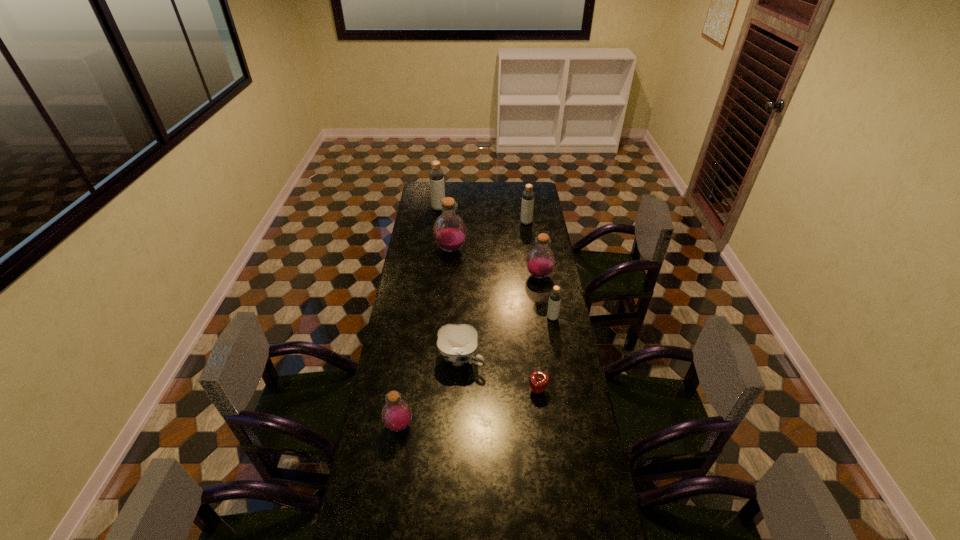
Find the location of `purple bottle that is the second closest to the second smallest purple bottle`. purple bottle that is the second closest to the second smallest purple bottle is located at coordinates (396, 414).

This screenshot has width=960, height=540. What are the coordinates of `vacant area in the image that satisfies the following two spatial constraints: 1. on the back side of the sixth farthest object; 2. on the right side of the second biggest gray bottle` in the screenshot? It's located at (468, 222).

The width and height of the screenshot is (960, 540). In order to click on blank area in the image that satisfies the following two spatial constraints: 1. on the back side of the second farthest purple bottle; 2. on the left side of the blue chinaware in this screenshot , I will do `click(465, 276)`.

Where is `vacant area that satisfies the following two spatial constraints: 1. on the back side of the seventh nearest object; 2. on the right side of the nearest purple bottle`? The width and height of the screenshot is (960, 540). vacant area that satisfies the following two spatial constraints: 1. on the back side of the seventh nearest object; 2. on the right side of the nearest purple bottle is located at coordinates (430, 222).

The image size is (960, 540). I want to click on free space that satisfies the following two spatial constraints: 1. on the front side of the third nearest object; 2. on the right side of the farthest bottle, so click(x=419, y=359).

Find the location of a particular element. The image size is (960, 540). blank space that satisfies the following two spatial constraints: 1. on the front side of the fifth farthest object; 2. on the right side of the farthest bottle is located at coordinates (424, 318).

Where is `free location that satisfies the following two spatial constraints: 1. on the front side of the fourth nearest bottle; 2. on the left side of the seventh farthest object`? free location that satisfies the following two spatial constraints: 1. on the front side of the fourth nearest bottle; 2. on the left side of the seventh farthest object is located at coordinates 439,390.